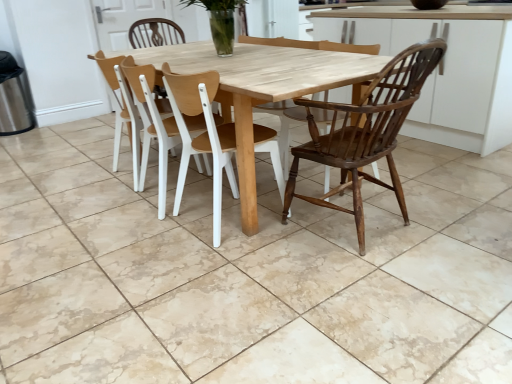
Where is `wooden chair at right`? Image resolution: width=512 pixels, height=384 pixels. wooden chair at right is located at coordinates (445, 68).

What do you see at coordinates (366, 131) in the screenshot?
I see `dark brown wood chair at right, marked as the third chair in a left-to-right arrangement` at bounding box center [366, 131].

Image resolution: width=512 pixels, height=384 pixels. I want to click on natural stone tile at center, so click(x=249, y=274).

Where is `wooden chair at center, which is the 2th chair in left-to-right order`? wooden chair at center, which is the 2th chair in left-to-right order is located at coordinates (201, 135).

How many degrees apart are the facing directions of dark brown wood chair at right, the first chair in the right-to-left sequence, and light wood table at center?

91.9 degrees separate the facing orientations of dark brown wood chair at right, the first chair in the right-to-left sequence, and light wood table at center.

Which object is positioned more to the left, dark brown wood chair at right, the first chair in the right-to-left sequence, or light wood table at center?

light wood table at center is more to the left.

Is dark brown wood chair at right, the first chair in the right-to-left sequence, bigger than light wood table at center?

Actually, dark brown wood chair at right, the first chair in the right-to-left sequence, might be smaller than light wood table at center.

From a real-world perspective, is dark brown wood chair at right, the first chair in the right-to-left sequence, positioned over light wood table at center based on gravity?

Yes.

From a real-world perspective, does wooden chair at right stand above wooden chair at center, the 2th chair from the right?

Yes, from a real-world perspective, wooden chair at right is over wooden chair at center, the 2th chair from the right

Is wooden chair at right shorter than wooden chair at center, the 2th chair from the right?

In fact, wooden chair at right may be taller than wooden chair at center, the 2th chair from the right.

How different are the orientations of wooden chair at right and wooden chair at center, which is the 2th chair in left-to-right order, in degrees?

There is a 180-degree angle between the facing directions of wooden chair at right and wooden chair at center, which is the 2th chair in left-to-right order.

Based on the photo, can you confirm if wooden chair at right is smaller than wooden chair at center, the 2th chair from the right?

No, wooden chair at right is not smaller than wooden chair at center, the 2th chair from the right.

How different are the orientations of light wood table at center and dark brown wood chair at right, the first chair in the right-to-left sequence, in degrees?

They differ by 91.9 degrees in their facing directions.

Visually, is light wood table at center positioned to the left or to the right of dark brown wood chair at right, the first chair in the right-to-left sequence?

light wood table at center is positioned on dark brown wood chair at right, the first chair in the right-to-left sequence,'s left side.

Does light wood table at center turn towards dark brown wood chair at right, the first chair in the right-to-left sequence?

No, light wood table at center is not facing towards dark brown wood chair at right, the first chair in the right-to-left sequence.

From a real-world perspective, who is located lower, light wood table at center or dark brown wood chair at right, the first chair in the right-to-left sequence?

light wood table at center.

Is wooden chair at center, the 2th chair from the right, inside or outside of wooden chair at right?

wooden chair at center, the 2th chair from the right, is spatially situated outside wooden chair at right.

From a real-world perspective, is wooden chair at center, which is the 2th chair in left-to-right order, positioned over wooden chair at right based on gravity?

No, from a real-world perspective, wooden chair at center, which is the 2th chair in left-to-right order, is not on top of wooden chair at right.

How different are the orientations of wooden chair at center, which is the 2th chair in left-to-right order, and wooden chair at right in degrees?

The angle between the facing direction of wooden chair at center, which is the 2th chair in left-to-right order, and the facing direction of wooden chair at right is 180 degrees.

Is light wood table at center oriented towards wooden chair at center, the 2th chair from the right?

Yes, light wood table at center faces towards wooden chair at center, the 2th chair from the right.

Can you confirm if light wood table at center is taller than wooden chair at center, which is the 2th chair in left-to-right order?

No, light wood table at center is not taller than wooden chair at center, which is the 2th chair in left-to-right order.

Is point (198, 71) in front of point (180, 201)?

Yes.

Can you confirm if clear glass vase at center is shorter than light wood table at center?

Yes.

The image size is (512, 384). I want to click on kitchen & dining room table below the clear glass vase at center (from the image's perspective), so click(259, 88).

From the image's perspective, which one is positioned higher, clear glass vase at center or light wood table at center?

clear glass vase at center is shown above in the image.

Is clear glass vase at center spatially inside light wood table at center, or outside of it?

clear glass vase at center is not enclosed by light wood table at center.

Consider the image. How distant is clear glass vase at center from wooden chair at center, the 2th chair from the right?

clear glass vase at center and wooden chair at center, the 2th chair from the right, are 74.65 centimeters apart from each other.

Is clear glass vase at center positioned in front of wooden chair at center, which is the 2th chair in left-to-right order?

No, it is behind wooden chair at center, which is the 2th chair in left-to-right order.

Considering the relative sizes of clear glass vase at center and wooden chair at center, which is the 2th chair in left-to-right order, in the image provided, is clear glass vase at center wider than wooden chair at center, which is the 2th chair in left-to-right order,?

Correct, the width of clear glass vase at center exceeds that of wooden chair at center, which is the 2th chair in left-to-right order.

From a real-world perspective, is clear glass vase at center on wooden chair at center, which is the 2th chair in left-to-right order?

Yes.

The width and height of the screenshot is (512, 384). Identify the location of kitchen & dining room table below the dark brown wood chair at right, the first chair in the right-to-left sequence (from a real-world perspective). (259, 88).

You are a GUI agent. You are given a task and a screenshot of the screen. Output one action in this format:
    pyautogui.click(x=<x>, y=<y>)
    Task: Click on the cabinetry positioned vertically above the wooden chair at center, the 2th chair from the right (from a real-world perspective)
    This screenshot has height=384, width=512.
    Given the screenshot: What is the action you would take?
    pyautogui.click(x=445, y=68)

Looking at the image, which one is located further to dark brown wood chair at right, the first chair in the right-to-left sequence, wooden at center, which ranks as the third chair in right-to-left order, or natural stone tile at center?

Based on the image, wooden at center, which ranks as the third chair in right-to-left order, appears to be further to dark brown wood chair at right, the first chair in the right-to-left sequence.

Based on their spatial positions, is dark brown wood chair at right, the first chair in the right-to-left sequence, or wooden chair at right closer to clear glass vase at center?

dark brown wood chair at right, the first chair in the right-to-left sequence, is closer to clear glass vase at center.

Based on their spatial positions, is wooden chair at center, the 2th chair from the right, or natural stone tile at center closer to dark brown wood chair at right, the first chair in the right-to-left sequence?

Based on the image, wooden chair at center, the 2th chair from the right, appears to be nearer to dark brown wood chair at right, the first chair in the right-to-left sequence.

Considering their positions, is dark brown wood chair at right, the first chair in the right-to-left sequence, positioned closer to wooden at center, arranged as the first chair when viewed from the left, than clear glass vase at center?

clear glass vase at center lies closer to wooden at center, arranged as the first chair when viewed from the left, than the other object.

Based on their spatial positions, is wooden chair at right or natural stone tile at center closer to dark brown wood chair at right, marked as the third chair in a left-to-right arrangement?

natural stone tile at center is positioned closer to the anchor dark brown wood chair at right, marked as the third chair in a left-to-right arrangement.

From the image, which object appears to be nearer to wooden chair at right, dark brown wood chair at right, marked as the third chair in a left-to-right arrangement, or light wood table at center?

light wood table at center is closer to wooden chair at right.

Which object lies further to the anchor point wooden at center, arranged as the first chair when viewed from the left, light wood table at center or clear glass vase at center?

clear glass vase at center.

Which object lies nearer to the anchor point wooden chair at center, the 2th chair from the right, light wood table at center or wooden at center, arranged as the first chair when viewed from the left?

light wood table at center.

Where is `plant between light wood table at center and wooden at center, which ranks as the third chair in right-to-left order, along the z-axis`? Image resolution: width=512 pixels, height=384 pixels. plant between light wood table at center and wooden at center, which ranks as the third chair in right-to-left order, along the z-axis is located at coordinates (219, 21).

Image resolution: width=512 pixels, height=384 pixels. I want to click on kitchen & dining room table between natural stone tile at center and wooden chair at center, the 2th chair from the right, in the front-back direction, so click(259, 88).

Identify the location of chair located between wooden chair at center, the 2th chair from the right, and wooden chair at right in the left-right direction. (366, 131).

Where is `plant located between wooden at center, which ranks as the third chair in right-to-left order, and wooden chair at right in the left-right direction`? The image size is (512, 384). plant located between wooden at center, which ranks as the third chair in right-to-left order, and wooden chair at right in the left-right direction is located at coordinates (219, 21).